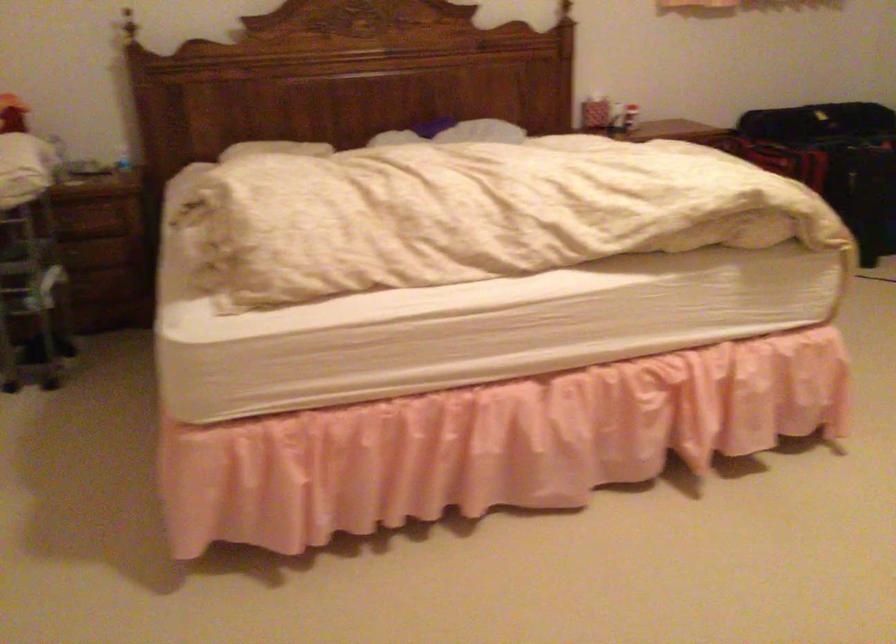
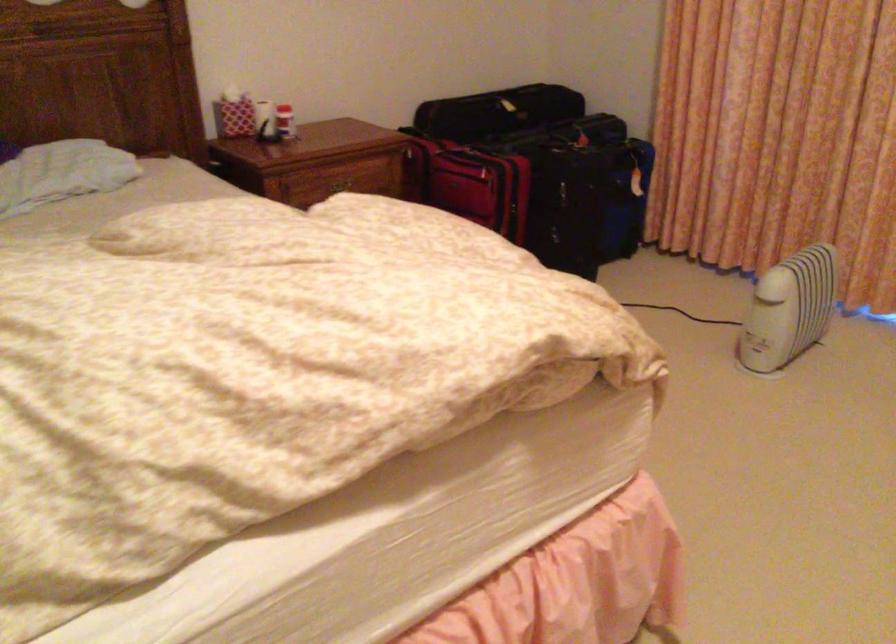
Find the pixel in the second image that matches the point at 778,147 in the first image.

(469, 183)